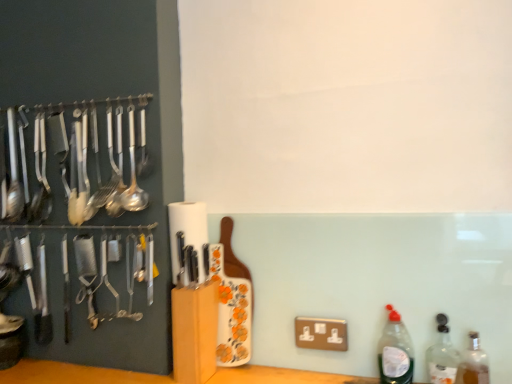
Question: From the image's perspective, is translucent glass bottle at lower right, the 3th bottle from the left, located beneath translucent plastic bottle at lower right, which is the third bottle in right-to-left order?

Choices:
 (A) no
 (B) yes

Answer: (B)

Question: Can you confirm if translucent glass bottle at lower right, the 3th bottle from the left, is taller than translucent plastic bottle at lower right, acting as the 1th bottle starting from the left?

Choices:
 (A) no
 (B) yes

Answer: (A)

Question: Considering the relative positions of translucent glass bottle at lower right, marked as the 1th bottle in a right-to-left arrangement, and translucent plastic bottle at lower right, which is the third bottle in right-to-left order, in the image provided, is translucent glass bottle at lower right, marked as the 1th bottle in a right-to-left arrangement, to the left of translucent plastic bottle at lower right, which is the third bottle in right-to-left order, from the viewer's perspective?

Choices:
 (A) yes
 (B) no

Answer: (B)

Question: Is translucent glass bottle at lower right, marked as the 1th bottle in a right-to-left arrangement, to the right of translucent plastic bottle at lower right, acting as the 1th bottle starting from the left, from the viewer's perspective?

Choices:
 (A) yes
 (B) no

Answer: (A)

Question: Can you see translucent glass bottle at lower right, the 3th bottle from the left, touching translucent plastic bottle at lower right, acting as the 1th bottle starting from the left?

Choices:
 (A) no
 (B) yes

Answer: (A)

Question: Considering the positions of white matte paper towel at center and clear glass bottle at right, placed as the 2th bottle when sorted from right to left, in the image, is white matte paper towel at center wider or thinner than clear glass bottle at right, placed as the 2th bottle when sorted from right to left,?

Choices:
 (A) wide
 (B) thin

Answer: (A)

Question: Do you think white matte paper towel at center is within clear glass bottle at right, placed as the second bottle when sorted from left to right, or outside of it?

Choices:
 (A) inside
 (B) outside

Answer: (B)

Question: In terms of size, does white matte paper towel at center appear bigger or smaller than clear glass bottle at right, placed as the 2th bottle when sorted from right to left?

Choices:
 (A) big
 (B) small

Answer: (A)

Question: From a real-world perspective, is white matte paper towel at center physically located above or below clear glass bottle at right, placed as the second bottle when sorted from left to right?

Choices:
 (A) below
 (B) above

Answer: (B)

Question: Is point (81, 107) positioned closer to the camera than point (441, 370)?

Choices:
 (A) closer
 (B) farther

Answer: (B)

Question: Is polished silver spoon at left to the left or to the right of clear glass bottle at right, placed as the 2th bottle when sorted from right to left, in the image?

Choices:
 (A) right
 (B) left

Answer: (B)

Question: Considering the positions of polished silver spoon at left and clear glass bottle at right, placed as the second bottle when sorted from left to right, in the image, is polished silver spoon at left wider or thinner than clear glass bottle at right, placed as the second bottle when sorted from left to right,?

Choices:
 (A) thin
 (B) wide

Answer: (B)

Question: Considering their positions, is polished silver spoon at left located in front of or behind clear glass bottle at right, placed as the 2th bottle when sorted from right to left?

Choices:
 (A) behind
 (B) front

Answer: (A)

Question: Considering the relative positions of polished silver spoon at left and white matte paper towel at center in the image provided, is polished silver spoon at left to the left or to the right of white matte paper towel at center?

Choices:
 (A) right
 (B) left

Answer: (B)

Question: In terms of size, does polished silver spoon at left appear bigger or smaller than white matte paper towel at center?

Choices:
 (A) small
 (B) big

Answer: (B)